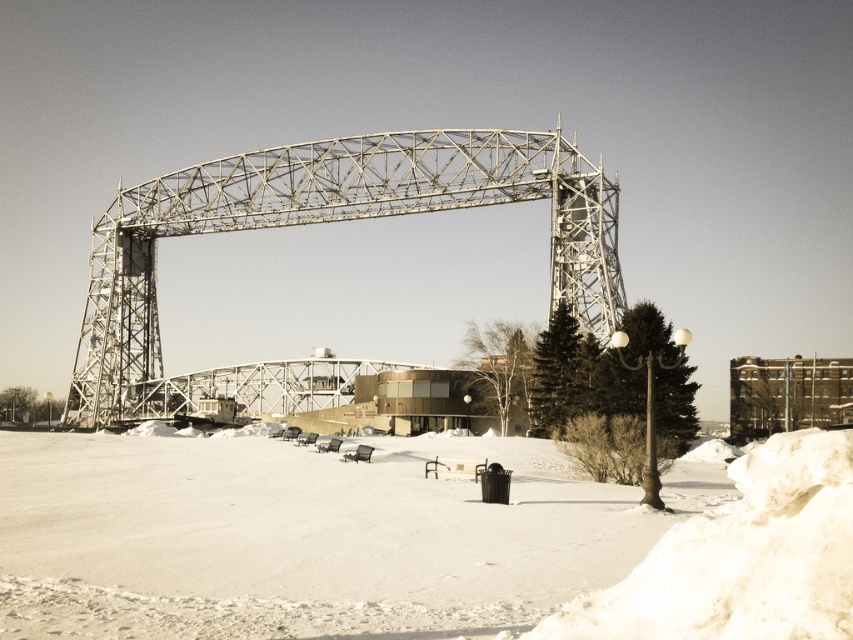
Is white powdery snow at lower left shorter than metallic gray bridge at center?

Yes, white powdery snow at lower left is shorter than metallic gray bridge at center.

Is white powdery snow at lower left above metallic gray bridge at center?

No, white powdery snow at lower left is not above metallic gray bridge at center.

Measure the distance between point (386, 483) and camera.

Point (386, 483) is 91.31 meters away from camera.

Where is `white powdery snow at lower left`? The image size is (853, 640). white powdery snow at lower left is located at coordinates (410, 541).